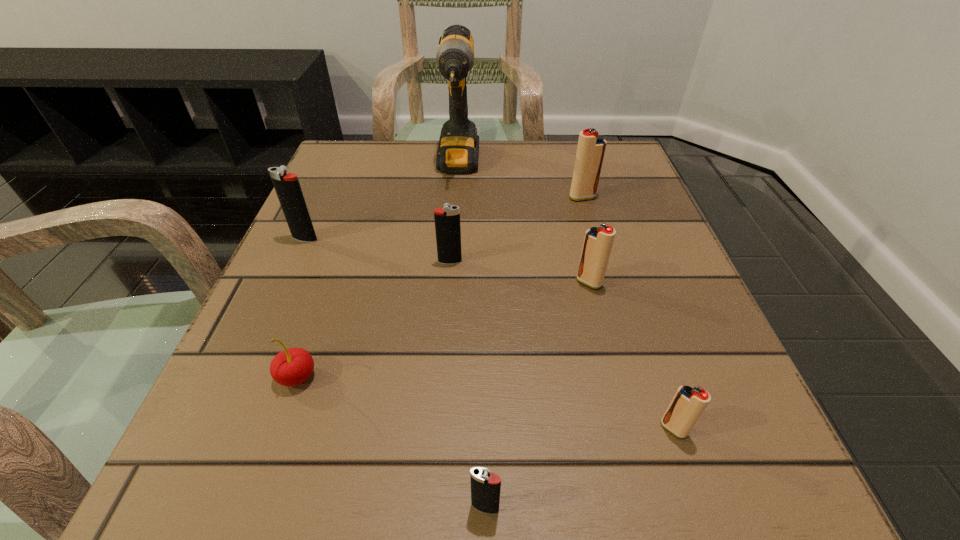
Locate an element on the screen. cherry is located at coordinates (293, 366).

At what (x,y) coordinates should I click in order to perform the action: click on the fifth farthest igniter. Please return your answer as a coordinate pair (x, y). This screenshot has width=960, height=540. Looking at the image, I should click on (687, 405).

Where is `the seventh farthest object`? the seventh farthest object is located at coordinates (687, 405).

I want to click on the nearest object, so click(485, 486).

Locate an element on the screen. the nearest black igniter is located at coordinates (485, 486).

Where is `blank space located 0.380m with the drill bit of the tallest object facing forward`? Image resolution: width=960 pixels, height=540 pixels. blank space located 0.380m with the drill bit of the tallest object facing forward is located at coordinates (446, 334).

Where is `free space located 0.300m on the left of the farthest red igniter`? The image size is (960, 540). free space located 0.300m on the left of the farthest red igniter is located at coordinates (425, 197).

Identify the location of blank space located on the right of the leftmost black igniter. point(500,239).

Find the location of a particular element. The width and height of the screenshot is (960, 540). free location located 0.280m on the back of the second black igniter from right to left is located at coordinates (456, 175).

At what (x,y) coordinates should I click in order to perform the action: click on free region located on the right of the third nearest igniter. Please return your answer as a coordinate pair (x, y). The image size is (960, 540). Looking at the image, I should click on (631, 282).